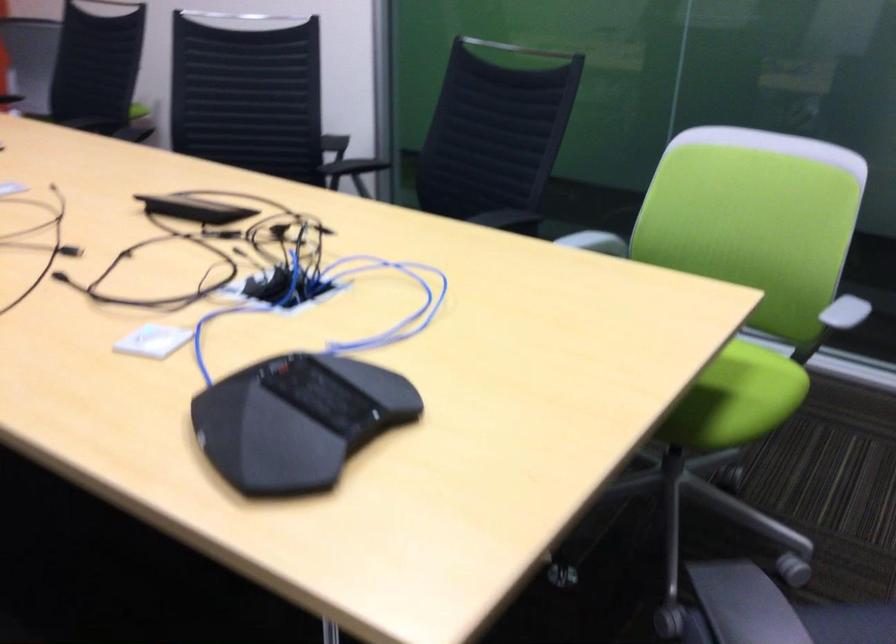
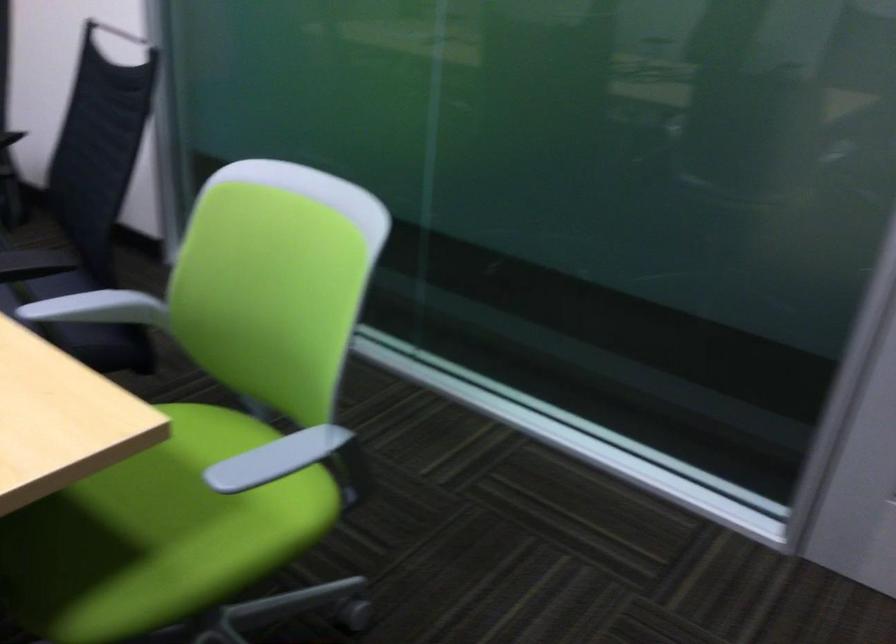
In the second image, find the point that corresponds to (589,243) in the first image.

(97, 308)